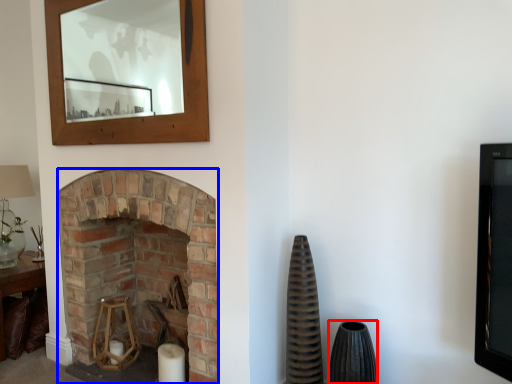
Question: Which point is closer to the camera, vase (highlighted by a red box) or fireplace (highlighted by a blue box)?

Choices:
 (A) vase
 (B) fireplace

Answer: (A)